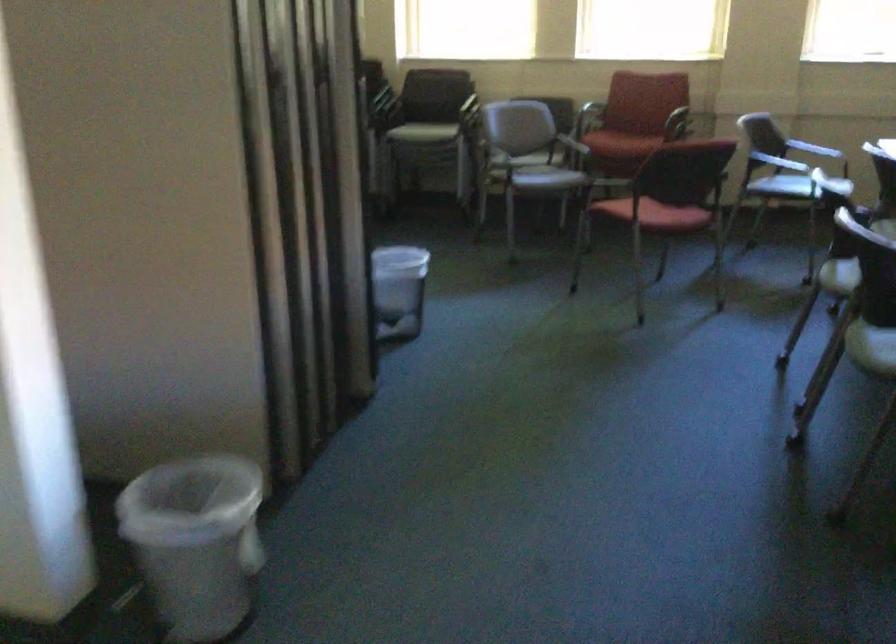
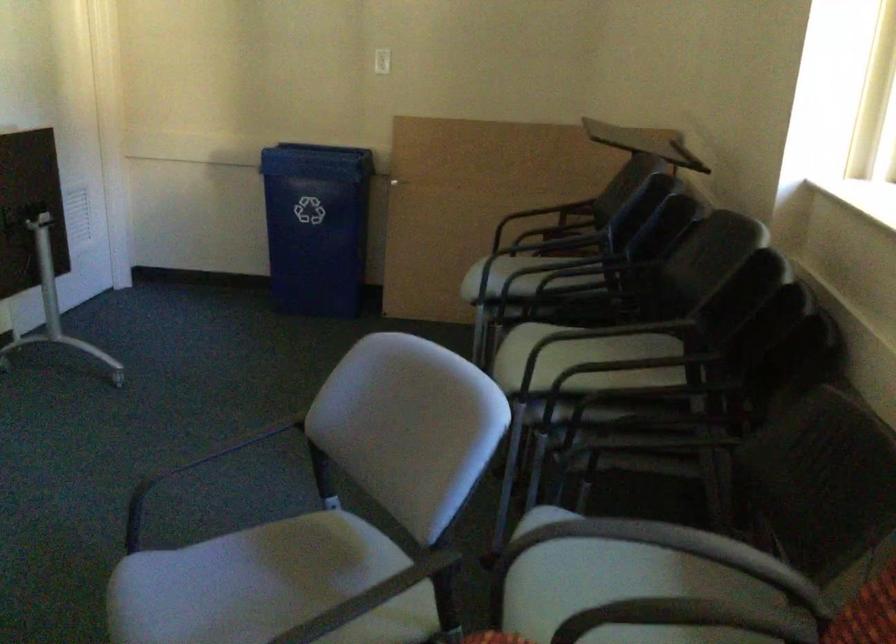
The point at (506,142) is marked in the first image. Where is the corresponding point in the second image?

(230, 446)